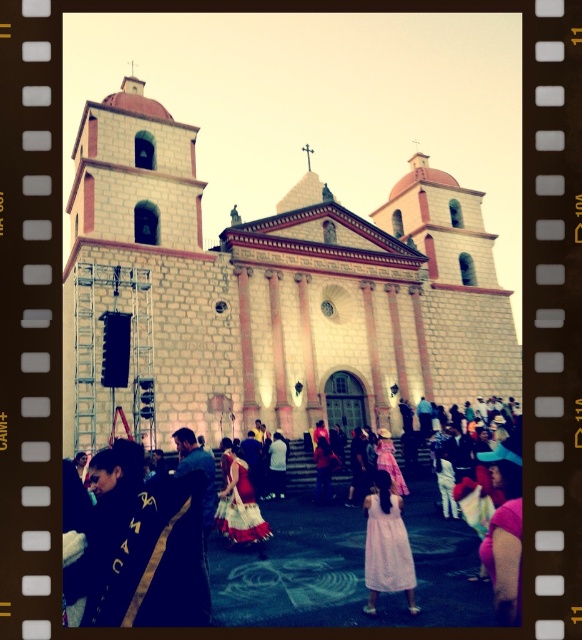
Describe the element at coordinates (269, 292) in the screenshot. The height and width of the screenshot is (640, 582). I see `beige stone church at center` at that location.

Is beige stone church at center behind red satin dress at center?

Yes.

Is point (286, 259) positioned before point (243, 520)?

No, it is behind (243, 520).

Where is `beige stone church at center`? beige stone church at center is located at coordinates (269, 292).

In the scene shown: Who is shorter, beige stone church at center or white lace dress at center?

white lace dress at center is shorter.

The width and height of the screenshot is (582, 640). What do you see at coordinates (269, 292) in the screenshot?
I see `beige stone church at center` at bounding box center [269, 292].

Image resolution: width=582 pixels, height=640 pixels. What are the coordinates of `beige stone church at center` in the screenshot? It's located at (269, 292).

Between point (178, 337) and point (393, 456), which one is positioned behind?

The point (393, 456) is more distant.

Can you confirm if beige stone church at center is positioned below plaid fabric dress at center?

Actually, beige stone church at center is above plaid fabric dress at center.

Is point (129, 92) positioned before point (385, 456)?

No, it is not.

Locate an element on the screen. beige stone church at center is located at coordinates (269, 292).